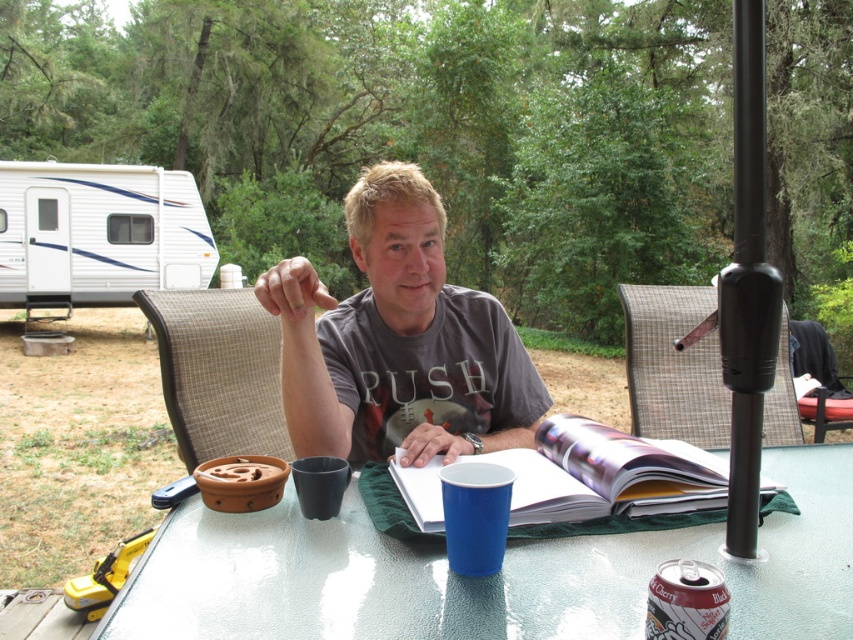
You are designing a layout for a small campsite merchandise booth. You have a gray cotton shirt at center and a blue plastic cup at lower center to display. Given their sizes, which item should you place on the wider shelf to ensure it fits properly?

The gray cotton shirt at center has a larger width than the blue plastic cup at lower center, so it should be placed on the wider shelf to ensure proper fit.

You are a photographer trying to capture the scene of the person at the campsite. To ensure the gray cotton shirt at center is visible in the reflection of the transparent glass table at center, where should you position yourself relative to the table?

The transparent glass table at center is below the gray cotton shirt at center, so positioning yourself directly above the table would allow you to see the reflection of the shirt in the glass surface.

You need to place a rectangular box that is 1.2 meters wide on the transparent glass table at center. Can the box fit on the table if the dull red can at lower right is moved aside?

The transparent glass table at center is wider than the dull red can at lower right. Since the table is wider, there is enough space to place the 1.2 meter wide box after moving the can aside.